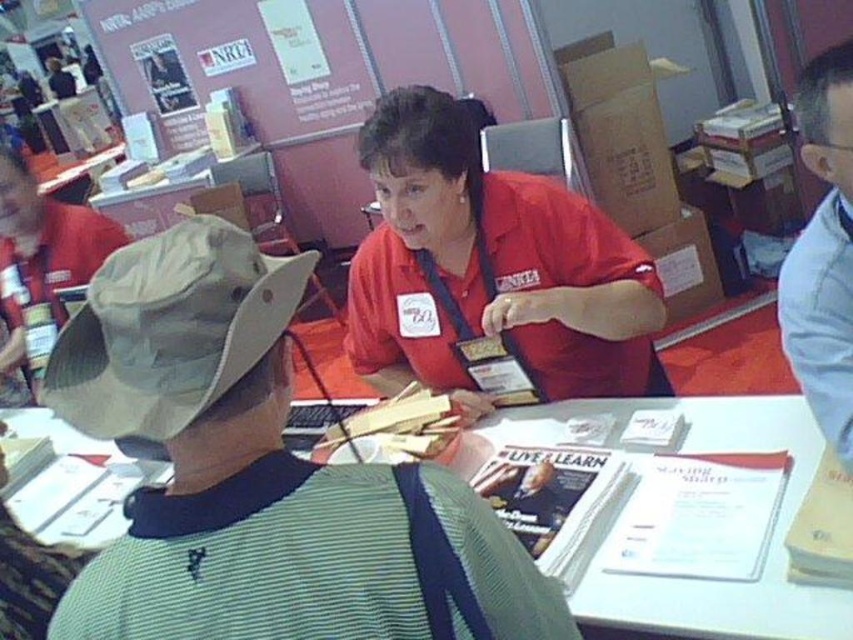
Does white paper at center have a lesser width compared to white shirt at upper right?

No, white paper at center is not thinner than white shirt at upper right.

Is point (19, 410) more distant than point (844, 362)?

Yes, it is.

Between point (671, 580) and point (798, 260), which one is positioned in front?

Point (671, 580) is more forward.

Where is `white paper at center`? white paper at center is located at coordinates coord(685,577).

Does matte khaki hat at center have a greater width compared to white paper at center?

No, matte khaki hat at center is not wider than white paper at center.

Does point (239, 266) lie behind point (44, 483)?

That is False.

At what (x,y) coordinates should I click in order to perform the action: click on matte khaki hat at center. Please return your answer as a coordinate pair (x, y). The width and height of the screenshot is (853, 640). Looking at the image, I should click on (260, 476).

Who is higher up, tan fabric hat at left or white shirt at upper right?

white shirt at upper right is above.

Is point (218, 227) closer to viewer compared to point (811, 378)?

That is True.

I want to click on tan fabric hat at left, so tap(170, 330).

I want to click on tan fabric hat at left, so click(170, 330).